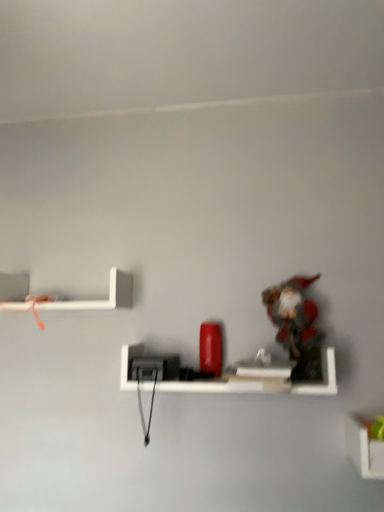
Question: Should I look upward or downward to see fuzzy fabric toy at right?

Choices:
 (A) up
 (B) down

Answer: (B)

Question: From a real-world perspective, is white matte shelf at lower right, which is counted as the third shelf, starting from the left, physically above matte black shelf at center, which appears as the 2th shelf when ordered from the bottom?

Choices:
 (A) yes
 (B) no

Answer: (B)

Question: From a real-world perspective, does white matte shelf at lower right, which ranks as the 1th shelf in bottom-to-top order, sit lower than matte black shelf at center, marked as the second shelf in a right-to-left arrangement?

Choices:
 (A) yes
 (B) no

Answer: (A)

Question: Is white matte shelf at lower right, which is counted as the third shelf, starting from the left, to the right of matte black shelf at center, which ranks as the second shelf in left-to-right order, from the viewer's perspective?

Choices:
 (A) yes
 (B) no

Answer: (A)

Question: Could matte black shelf at center, which appears as the second shelf when viewed from the top, be considered to be inside white matte shelf at lower right, which appears as the 3th shelf when viewed from the top?

Choices:
 (A) no
 (B) yes

Answer: (A)

Question: From the image's perspective, is white matte shelf at lower right, which ranks as the 1th shelf in bottom-to-top order, on top of matte black shelf at center, which appears as the 2th shelf when ordered from the bottom?

Choices:
 (A) yes
 (B) no

Answer: (B)

Question: Can you confirm if white matte shelf at lower right, which appears as the 3th shelf when viewed from the top, is positioned to the left of matte black shelf at center, marked as the second shelf in a right-to-left arrangement?

Choices:
 (A) yes
 (B) no

Answer: (B)

Question: Is fuzzy fabric toy at right not inside white matte shelf at upper left, the 3th shelf positioned from the bottom?

Choices:
 (A) yes
 (B) no

Answer: (A)

Question: Does fuzzy fabric toy at right have a smaller size compared to white matte shelf at upper left, acting as the 1th shelf starting from the left?

Choices:
 (A) yes
 (B) no

Answer: (A)

Question: Can you confirm if fuzzy fabric toy at right is thinner than white matte shelf at upper left, positioned as the 1th shelf in top-to-bottom order?

Choices:
 (A) yes
 (B) no

Answer: (A)

Question: From the image's perspective, is fuzzy fabric toy at right over white matte shelf at upper left, acting as the 1th shelf starting from the left?

Choices:
 (A) yes
 (B) no

Answer: (B)

Question: Does fuzzy fabric toy at right have a larger size compared to white matte shelf at upper left, which is the 3th shelf in right-to-left order?

Choices:
 (A) no
 (B) yes

Answer: (A)

Question: Does fuzzy fabric toy at right touch white matte shelf at upper left, positioned as the 1th shelf in top-to-bottom order?

Choices:
 (A) no
 (B) yes

Answer: (A)

Question: Can you confirm if matte black shelf at center, which appears as the 2th shelf when ordered from the bottom, is shorter than white matte shelf at upper left, which is the 3th shelf in right-to-left order?

Choices:
 (A) yes
 (B) no

Answer: (A)